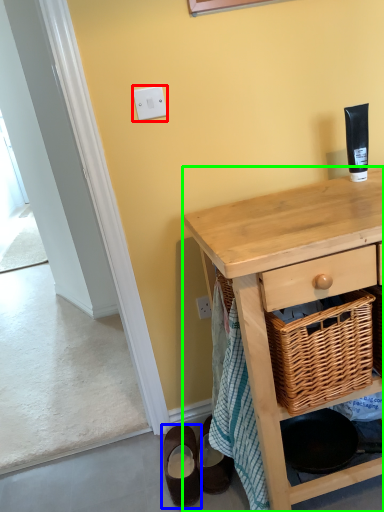
Question: Which object is the closest to the light switch (highlighted by a red box)? Choose among these: footwear (highlighted by a blue box) or desk (highlighted by a green box).

Choices:
 (A) footwear
 (B) desk

Answer: (B)